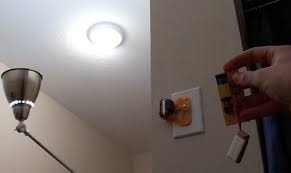
Find the location of a particular element. The width and height of the screenshot is (291, 173). white ceiling is located at coordinates (80, 72).